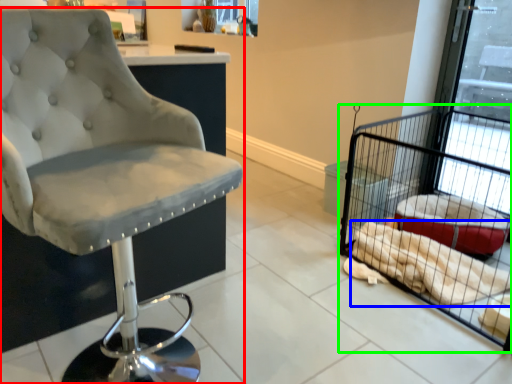
Question: Considering the real-world distances, which object is farthest from chair (highlighted by a red box)? material (highlighted by a blue box) or bird cage (highlighted by a green box)?

Choices:
 (A) material
 (B) bird cage

Answer: (B)